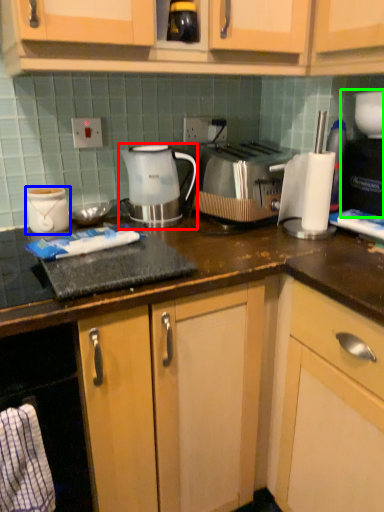
Question: Estimate the real-world distances between objects in this image. Which object is farther from kettle (highlighted by a red box), appliance (highlighted by a blue box) or coffee machine (highlighted by a green box)?

Choices:
 (A) appliance
 (B) coffee machine

Answer: (B)